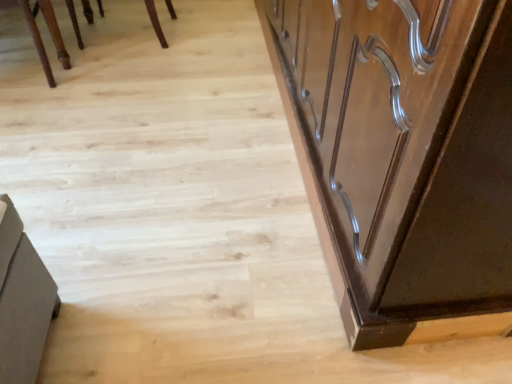
Where is `free space in front of brown wood chair leg at upper left`? The image size is (512, 384). free space in front of brown wood chair leg at upper left is located at coordinates (34, 116).